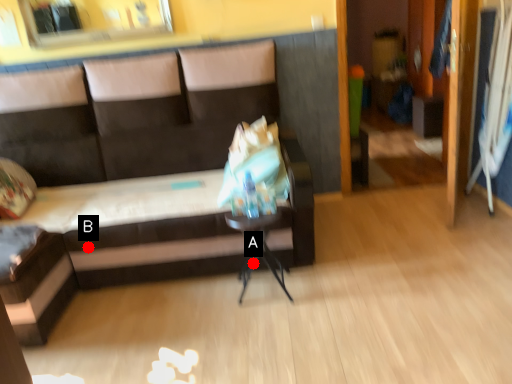
Question: Two points are circled on the image, labeled by A and B beside each circle. Which point is closer to the camera?

Choices:
 (A) A is closer
 (B) B is closer

Answer: (B)